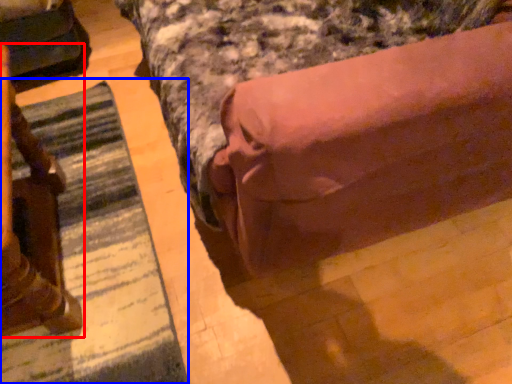
Question: Which point is further to the camera, furniture (highlighted by a red box) or mat (highlighted by a blue box)?

Choices:
 (A) furniture
 (B) mat

Answer: (B)